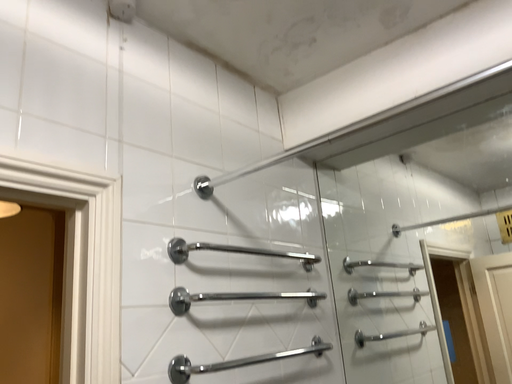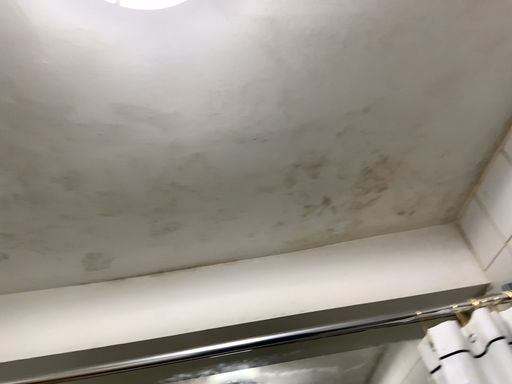
Question: How did the camera likely rotate when shooting the video?

Choices:
 (A) rotated downward
 (B) rotated upward

Answer: (B)